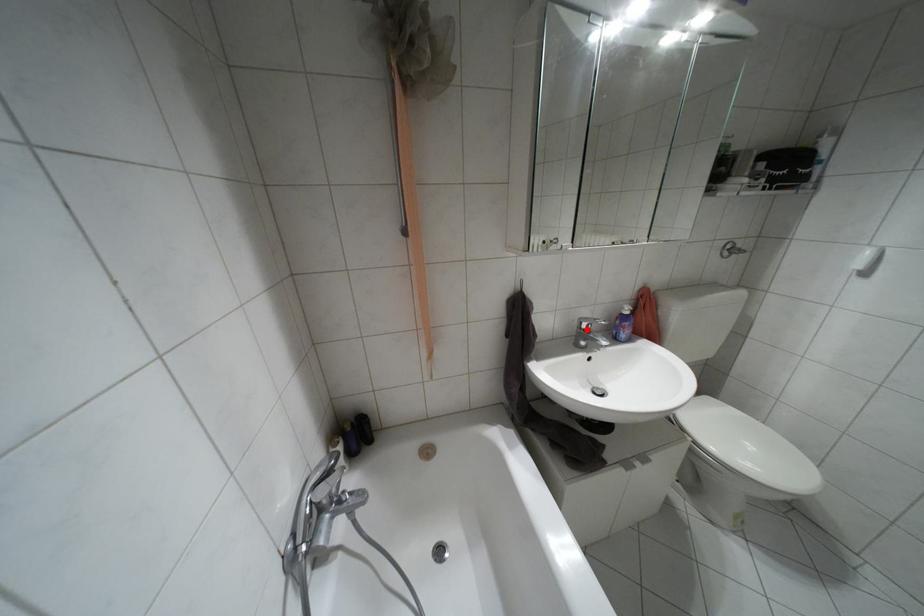
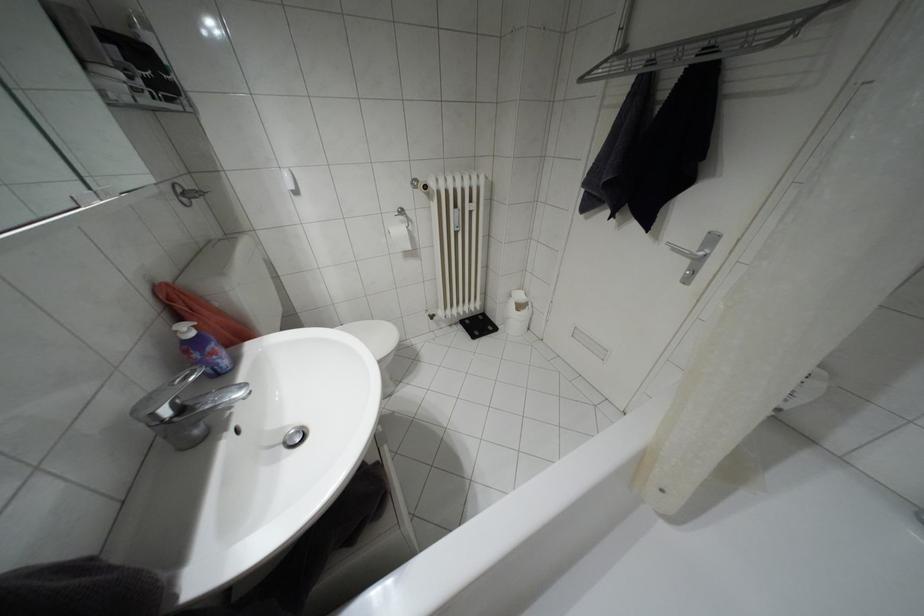
Where in the second image is the point corresponding to the highlighted location from the first image?

(180, 408)